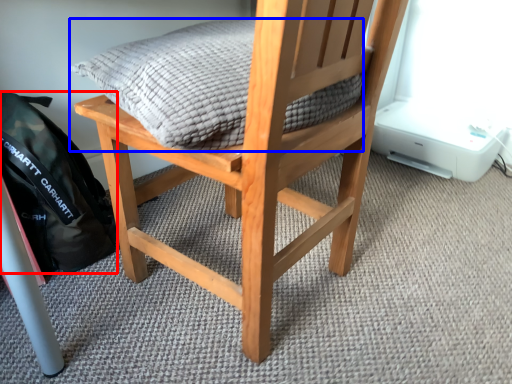
Question: Which of the following is the closest to the observer, backpack (highlighted by a red box) or pillow (highlighted by a blue box)?

Choices:
 (A) backpack
 (B) pillow

Answer: (B)